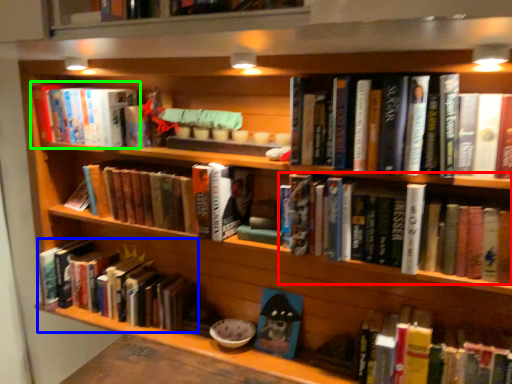
Question: Which is farther away from book (highlighted by a red box)? book (highlighted by a blue box) or book (highlighted by a green box)?

Choices:
 (A) book
 (B) book

Answer: (B)